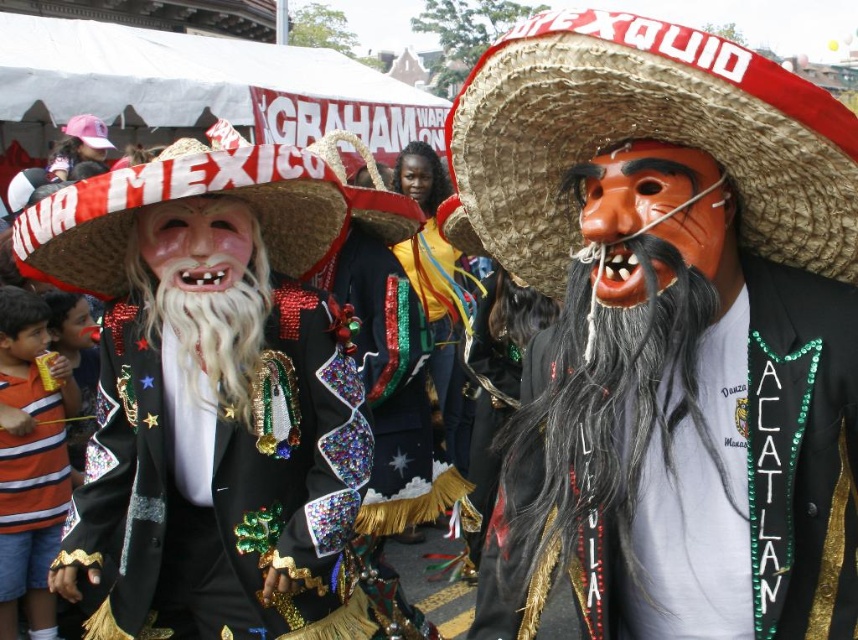
Question: Considering the relative positions of brown straw sombrero at center and shiny sequined jacket at center in the image provided, where is brown straw sombrero at center located with respect to shiny sequined jacket at center?

Choices:
 (A) left
 (B) right

Answer: (B)

Question: Estimate the real-world distances between objects in this image. Which object is farther from the shiny sequined jacket at center?

Choices:
 (A) brown straw sombrero at center
 (B) straw sombrero at left
 (C) matte black mask at center
 (D) whitehair/fiberbeard at center

Answer: (A)

Question: Which of the following is the farthest from the observer?

Choices:
 (A) whitehair/fiberbeard at center
 (B) brown straw sombrero at center
 (C) straw sombrero at left

Answer: (A)

Question: Among these objects, which one is nearest to the camera?

Choices:
 (A) shiny sequined jacket at center
 (B) matte black mask at center
 (C) brown straw sombrero at center

Answer: (B)

Question: Does matte black mask at center have a smaller size compared to shiny sequined jacket at center?

Choices:
 (A) yes
 (B) no

Answer: (B)

Question: Is brown straw sombrero at center thinner than straw sombrero at left?

Choices:
 (A) no
 (B) yes

Answer: (A)